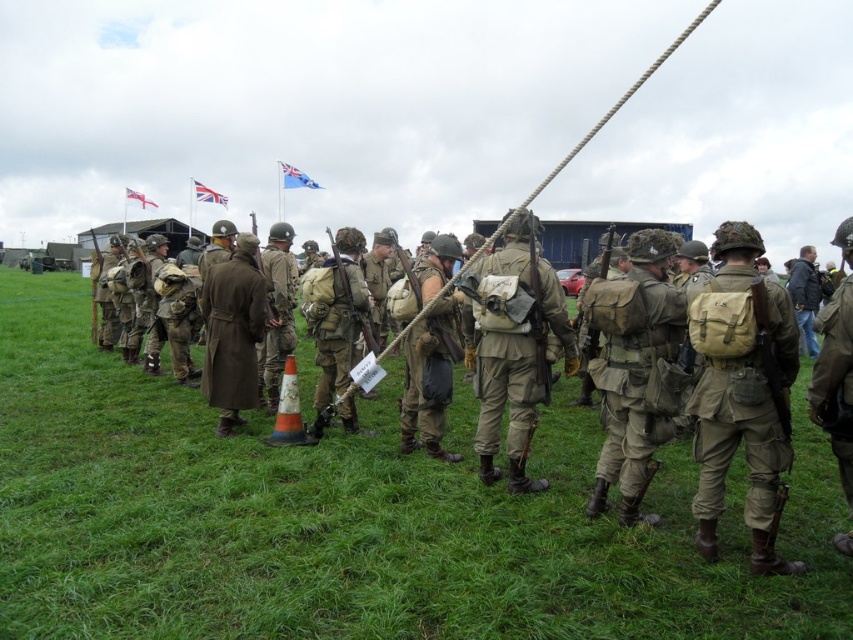
You are a photographer trying to capture a clear shot of both the brown wool coat at center and the tan canvas backpack at center. Since the coat is covering part of the backpack, can you adjust your angle to see the entire backpack without moving the coat?

The brown wool coat at center is positioned over the tan canvas backpack at center, so adjusting your angle might allow you to see parts of the backpack not covered by the coat. However, since the coat is directly over the backpack, some portion of the backpack will remain obscured unless the coat is moved.

In the scene shown: You are a photographer positioned at the edge of the field. You want to capture a photo that includes both the dark blue jacket at center and the union jack fabric flag at upper center. Based on their positions, which object should you adjust your camera to focus on first to ensure both are in frame?

The dark blue jacket at center is to the right of the union jack fabric flag at upper center. To include both in the frame, focus on the union jack fabric flag at upper center first since it is on the left, allowing you to adjust the camera to include the dark blue jacket at center to its right.

You are a photographer planning to take a group photo of the scene. You want to ensure that both the green grassy at center and the camouflage fabric backpack at center right are clearly visible. Given their sizes, which object should you focus on to ensure both are in frame without cropping?

Since the green grassy at center is larger than the camouflage fabric backpack at center right, you should focus on the green grassy at center to ensure both objects are in frame without cropping.